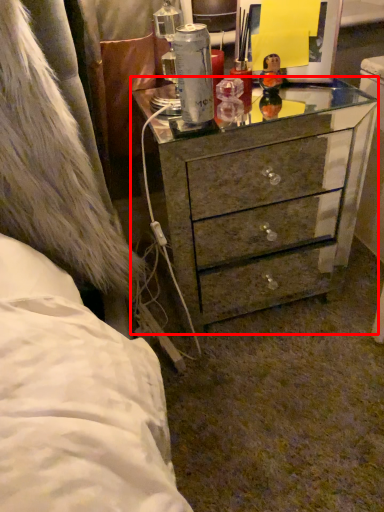
Question: In this image, where is chest of drawers (annotated by the red box) located relative to toy?

Choices:
 (A) right
 (B) left

Answer: (B)